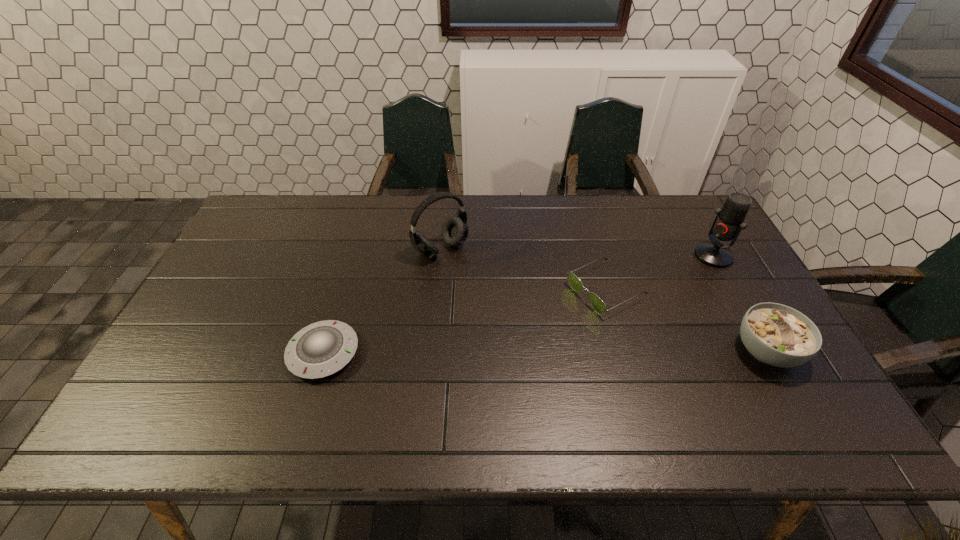
Locate an element on the screen. The width and height of the screenshot is (960, 540). blank region between the third tallest object and the leftmost object is located at coordinates (545, 352).

What are the coordinates of `unoccupied position between the headset and the third object from left to right` in the screenshot? It's located at (523, 269).

Locate an element on the screen. The width and height of the screenshot is (960, 540). blank region between the second object from left to right and the soup bowl is located at coordinates (604, 300).

You are a GUI agent. You are given a task and a screenshot of the screen. Output one action in this format:
    pyautogui.click(x=<x>, y=<y>)
    Task: Click on the vacant point located between the microphone and the headset
    This screenshot has width=960, height=540.
    Given the screenshot: What is the action you would take?
    pyautogui.click(x=577, y=252)

Where is `vacant point located between the microphone and the third shortest object`? vacant point located between the microphone and the third shortest object is located at coordinates (740, 303).

In order to click on free spot between the second object from left to right and the saucer in this screenshot , I will do tap(382, 301).

This screenshot has height=540, width=960. Find the location of `vacant area that lies between the third shortest object and the leftmost object`. vacant area that lies between the third shortest object and the leftmost object is located at coordinates (545, 352).

This screenshot has height=540, width=960. In order to click on free space between the leftmost object and the sunglasses in this screenshot , I will do `click(465, 321)`.

Locate an element on the screen. The width and height of the screenshot is (960, 540). the fourth closest object to the third object from left to right is located at coordinates (320, 349).

The height and width of the screenshot is (540, 960). Identify the location of object that is the fourth closest to the sunglasses. (320, 349).